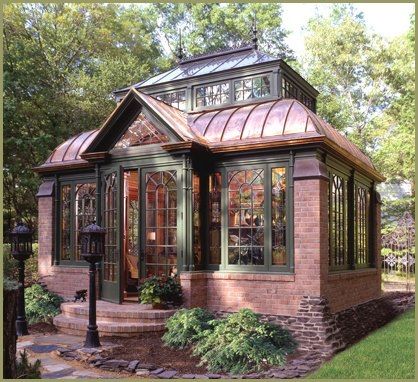
I want to click on window, so click(x=65, y=220), click(x=229, y=230), click(x=335, y=239), click(x=360, y=240).